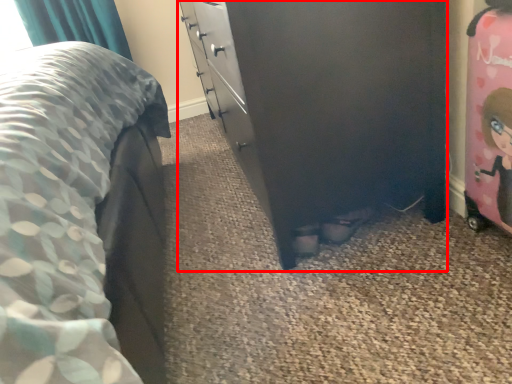
Question: Where is chest of drawers (annotated by the red box) located in relation to toy in the image?

Choices:
 (A) right
 (B) left

Answer: (B)